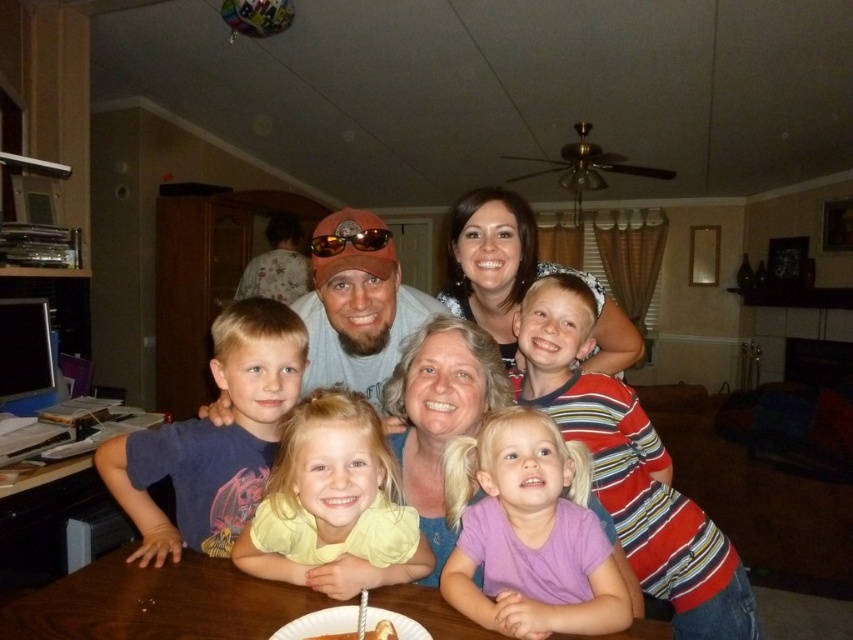
Who is positioned more to the right, purple cotton shirt at lower center or smooth chocolate cake at center?

Positioned to the right is purple cotton shirt at lower center.

Is purple cotton shirt at lower center smaller than smooth chocolate cake at center?

No.

The height and width of the screenshot is (640, 853). I want to click on purple cotton shirt at lower center, so (x=527, y=532).

Does dark blue t-shirt at left lie behind orange reflective lens cap at center?

No, it is in front of orange reflective lens cap at center.

Where is `dark blue t-shirt at left`? dark blue t-shirt at left is located at coordinates (213, 438).

Can you confirm if matte blue shirt at center is positioned to the left of brown wooden table at lower left?

No, matte blue shirt at center is not to the left of brown wooden table at lower left.

Measure the distance between matte blue shirt at center and brown wooden table at lower left.

matte blue shirt at center and brown wooden table at lower left are 1.46 meters apart.

Image resolution: width=853 pixels, height=640 pixels. Describe the element at coordinates (596, 420) in the screenshot. I see `matte blue shirt at center` at that location.

This screenshot has height=640, width=853. Find the location of `matte blue shirt at center`. matte blue shirt at center is located at coordinates (596, 420).